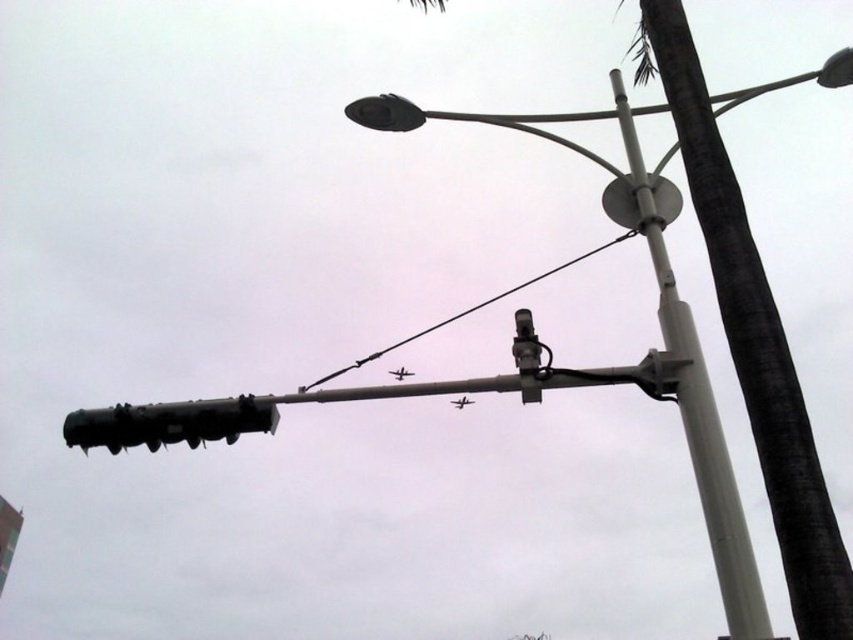
Consider the image. You are a city planner reviewing this street layout. You notice the white plastic street light at upper center and the white metallic pole at center. Which object is positioned higher in the image?

The white plastic street light at upper center is located above the white metallic pole at center, so it is positioned higher in the image.

You are standing at the street corner and see the point marked at coordinates point (257,429). Can you reach this point with a 5 meter long measuring tape without moving from your current position?

The distance of point (257,429) from viewer is 4.83 meters, so yes, the 5 meter long measuring tape can reach the point (257,429) as it is slightly shorter than the tape length.